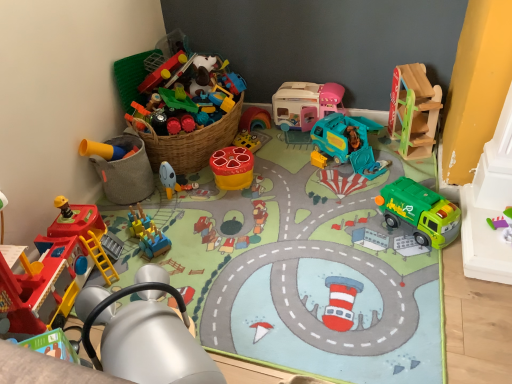
Where is `free spot in front of yellow matte bucket at lower left, the 9th toy when ordered from right to left`? The height and width of the screenshot is (384, 512). free spot in front of yellow matte bucket at lower left, the 9th toy when ordered from right to left is located at coordinates (128, 216).